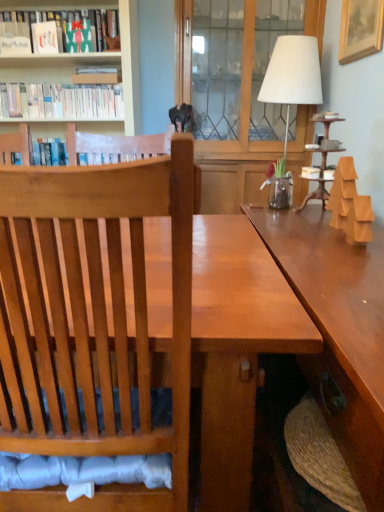
Question: Is white fabric lampshade at upper right positioned behind matte green book at upper left, which is counted as the first book, starting from the top?

Choices:
 (A) no
 (B) yes

Answer: (A)

Question: Considering the relative sizes of white fabric lampshade at upper right and matte green book at upper left, which is counted as the first book, starting from the top, in the image provided, is white fabric lampshade at upper right shorter than matte green book at upper left, which is counted as the first book, starting from the top,?

Choices:
 (A) no
 (B) yes

Answer: (A)

Question: Is white fabric lampshade at upper right oriented away from matte green book at upper left, which is counted as the first book, starting from the top?

Choices:
 (A) no
 (B) yes

Answer: (A)

Question: Is white fabric lampshade at upper right to the left of matte green book at upper left, the 3th book from the bottom, from the viewer's perspective?

Choices:
 (A) no
 (B) yes

Answer: (A)

Question: Can you confirm if white fabric lampshade at upper right is taller than matte green book at upper left, which is counted as the first book, starting from the top?

Choices:
 (A) no
 (B) yes

Answer: (B)

Question: From a real-world perspective, is white matte bookshelf at upper left, which is the 3th book from top to bottom, positioned above or below matte green book at upper left, the 3th book from the bottom?

Choices:
 (A) below
 (B) above

Answer: (A)

Question: Is white matte bookshelf at upper left, which is the 3th book from top to bottom, wider or thinner than matte green book at upper left, the 3th book from the bottom?

Choices:
 (A) wide
 (B) thin

Answer: (A)

Question: Is point 19,86 positioned closer to the camera than point 94,48?

Choices:
 (A) closer
 (B) farther

Answer: (B)

Question: From the image's perspective, is white matte bookshelf at upper left, which appears as the first book when ordered from the bottom, located above or below matte green book at upper left, which is counted as the first book, starting from the top?

Choices:
 (A) below
 (B) above

Answer: (A)

Question: Is matte green book at upper left, which is counted as the first book, starting from the top, spatially inside gold wooden picture frame at upper right, or outside of it?

Choices:
 (A) outside
 (B) inside

Answer: (A)

Question: Is matte green book at upper left, which is counted as the first book, starting from the top, wider or thinner than gold wooden picture frame at upper right?

Choices:
 (A) thin
 (B) wide

Answer: (B)

Question: From the image's perspective, is matte green book at upper left, the 3th book from the bottom, above or below gold wooden picture frame at upper right?

Choices:
 (A) above
 (B) below

Answer: (A)

Question: Considering the relative positions of matte green book at upper left, the 3th book from the bottom, and gold wooden picture frame at upper right in the image provided, is matte green book at upper left, the 3th book from the bottom, to the left or to the right of gold wooden picture frame at upper right?

Choices:
 (A) right
 (B) left

Answer: (B)

Question: In the image, is transparent glass door at center positioned in front of or behind white matte bookshelf at upper left, which is the 3th book from top to bottom?

Choices:
 (A) behind
 (B) front

Answer: (A)

Question: Would you say transparent glass door at center is inside or outside white matte bookshelf at upper left, which is the 3th book from top to bottom?

Choices:
 (A) outside
 (B) inside

Answer: (A)